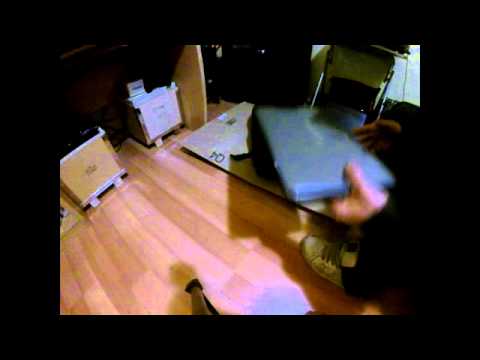
At what (x,y) coordinates should I click in order to perform the action: click on grey laptop. Please return your answer as a coordinate pair (x, y). The width and height of the screenshot is (480, 360). Looking at the image, I should click on (295, 161).